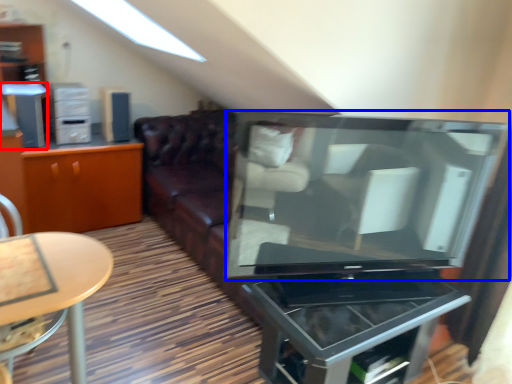
Question: Among these objects, which one is farthest to the camera, appliance (highlighted by a red box) or television (highlighted by a blue box)?

Choices:
 (A) appliance
 (B) television

Answer: (A)